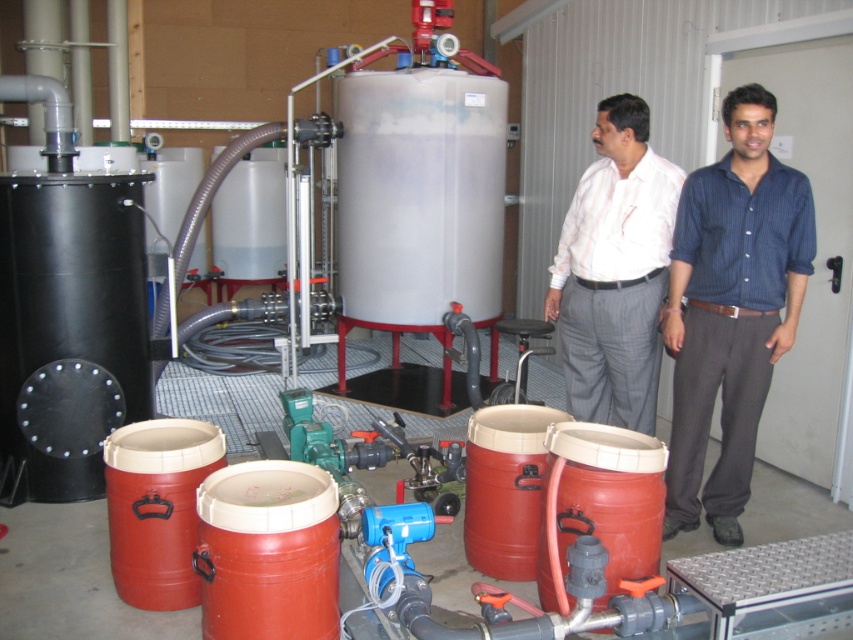
You are an observer in the industrial setting. You notice two shirts hanging on a rack. Which shirt is hanging lower between the blue striped shirt at right and the white striped shirt at center?

The blue striped shirt at right is positioned under the white striped shirt at center, so it is hanging lower.

You are an observer in the industrial setting. You notice two shirts hanging nearby. The blue striped shirt at right and the white striped shirt at center. Which shirt is positioned more to the right side of the scene?

The blue striped shirt at right is positioned more to the right side of the scene because it is to the right of the white striped shirt at center.